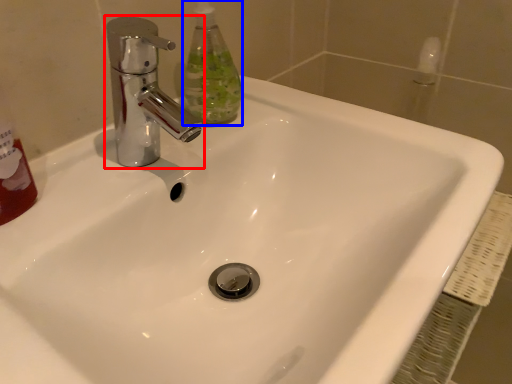
Question: Which object is closer to the camera taking this photo, tap (highlighted by a red box) or cleaning product (highlighted by a blue box)?

Choices:
 (A) tap
 (B) cleaning product

Answer: (A)